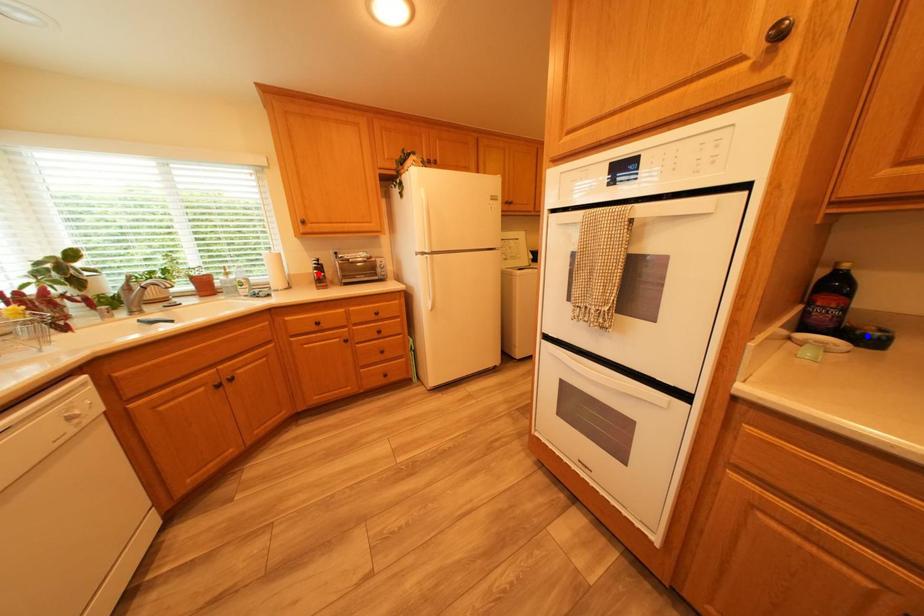
Question: Two points are marked on the image. Which point is closer to the camera?

Choices:
 (A) Blue point is closer.
 (B) Red point is closer.

Answer: (A)